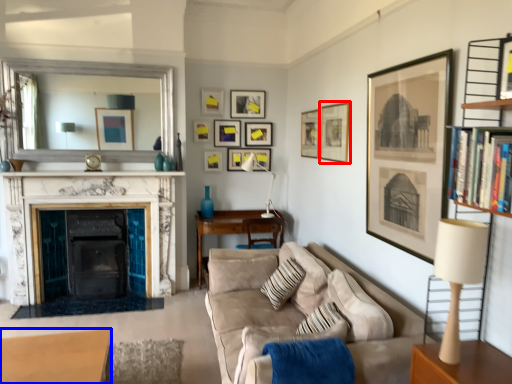
Question: Which point is further to the camera, picture frame (highlighted by a red box) or table (highlighted by a blue box)?

Choices:
 (A) picture frame
 (B) table

Answer: (A)